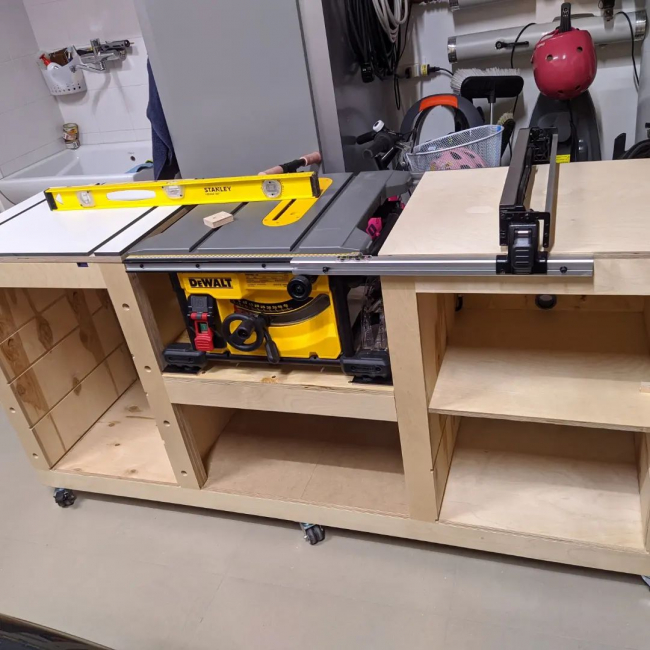
Locate an element on the screen. The height and width of the screenshot is (650, 650). cabinet is located at coordinates (236, 60).